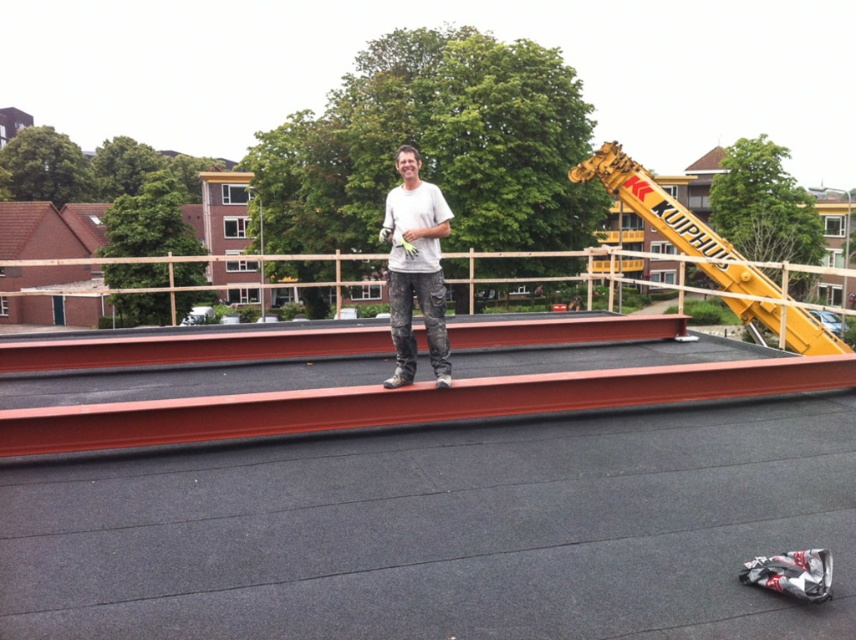
Which is below, red steel beams at center or white matte shirt at center?

red steel beams at center is lower down.

Is point (740, 358) farther from viewer compared to point (438, 296)?

Yes, it is behind point (438, 296).

Find the location of a particular element. The height and width of the screenshot is (640, 856). red steel beams at center is located at coordinates (403, 403).